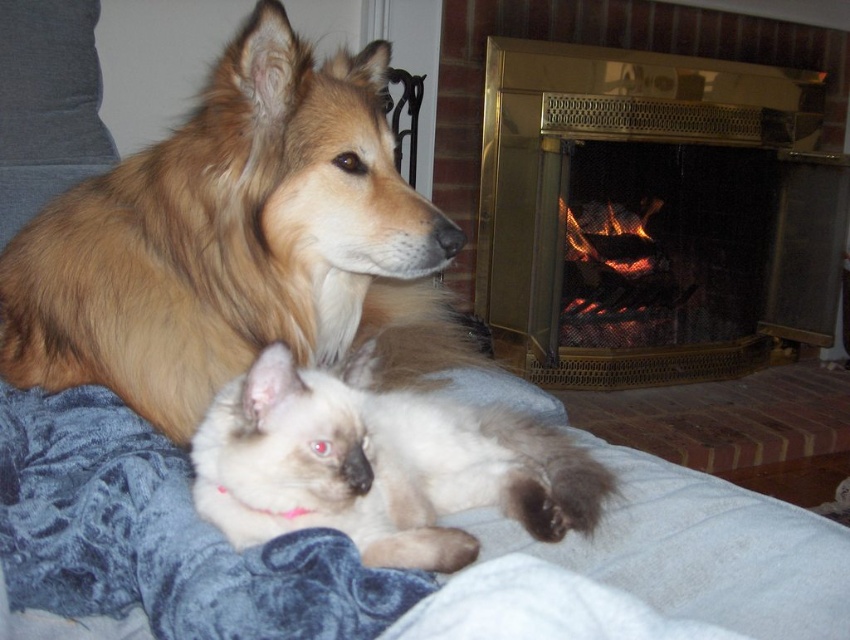
What do you see at coordinates (238, 243) in the screenshot?
I see `golden fur dog at upper left` at bounding box center [238, 243].

Does golden fur dog at upper left come behind gold brass fireplace at upper right?

No, it is not.

The height and width of the screenshot is (640, 850). What are the coordinates of `golden fur dog at upper left` in the screenshot? It's located at (238, 243).

Does point (480, 172) come behind point (216, 500)?

Yes.

Is gold brass fireplace at upper right closer to the viewer compared to silky white cat at center?

No, it is behind silky white cat at center.

Between point (763, 348) and point (218, 524), which one is positioned behind?

Point (763, 348)

You are a GUI agent. You are given a task and a screenshot of the screen. Output one action in this format:
    pyautogui.click(x=<x>, y=<y>)
    Task: Click on the gold brass fireplace at upper right
    This screenshot has width=850, height=640.
    Given the screenshot: What is the action you would take?
    pyautogui.click(x=652, y=214)

Is golden fur dog at upper left smaller than silky white cat at center?

Incorrect, golden fur dog at upper left is not smaller in size than silky white cat at center.

Can you confirm if golden fur dog at upper left is positioned to the left of silky white cat at center?

Yes, golden fur dog at upper left is to the left of silky white cat at center.

The width and height of the screenshot is (850, 640). Find the location of `golden fur dog at upper left`. golden fur dog at upper left is located at coordinates (238, 243).